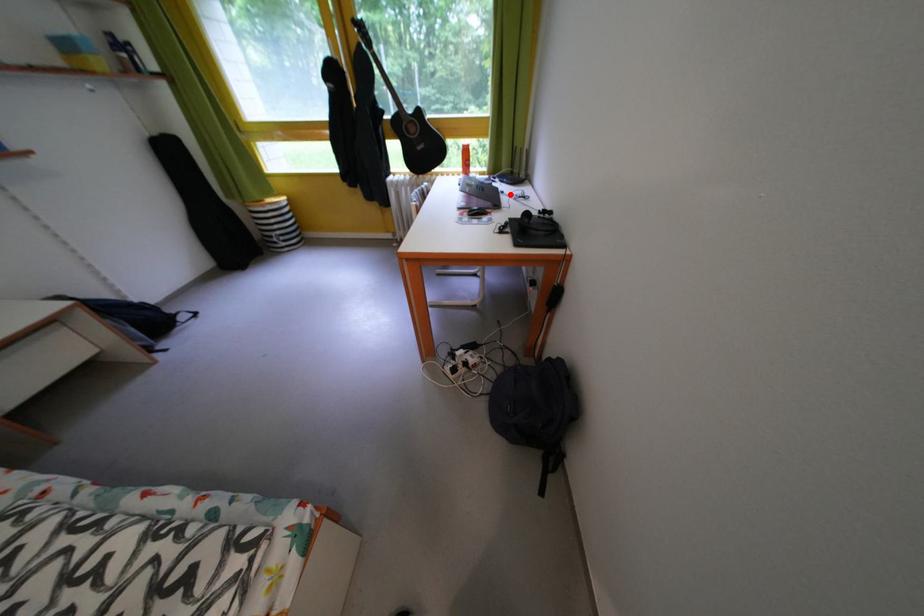
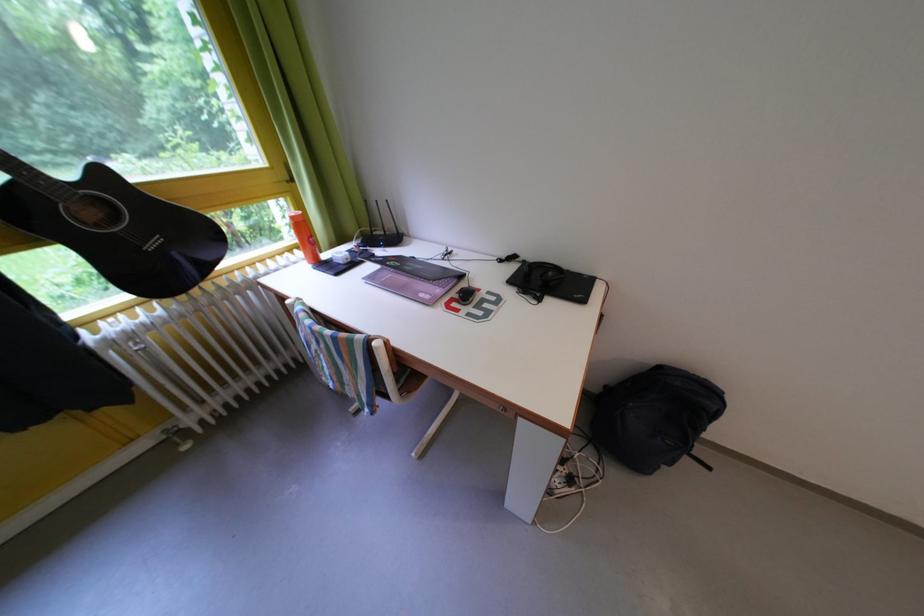
Find the pixel in the second image that matches the highlighted location in the first image.

(417, 261)